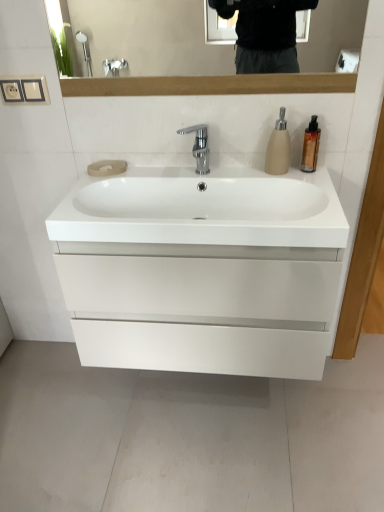
You are a GUI agent. You are given a task and a screenshot of the screen. Output one action in this format:
    pyautogui.click(x=<x>, y=<y>)
    Task: Click on the free space to the left of polished chrome faucet at center
    Image resolution: width=384 pixels, height=512 pixels.
    Given the screenshot: What is the action you would take?
    pyautogui.click(x=151, y=168)